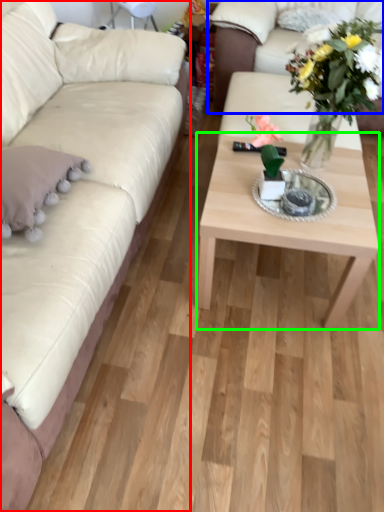
Question: Considering the real-world distances, which object is farthest from studio couch (highlighted by a red box)? studio couch (highlighted by a blue box) or coffee table (highlighted by a green box)?

Choices:
 (A) studio couch
 (B) coffee table

Answer: (A)